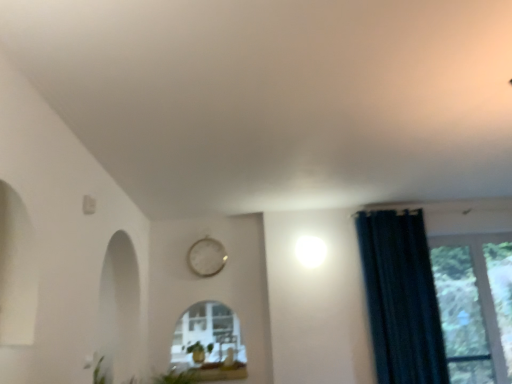
Question: Should I look upward or downward to see dark blue fabric curtain at right?

Choices:
 (A) up
 (B) down

Answer: (B)

Question: Does white glossy window sill at lower center have a greater width compared to dark blue fabric curtain at right?

Choices:
 (A) no
 (B) yes

Answer: (B)

Question: Is dark blue fabric curtain at right at the back of white glossy window sill at lower center?

Choices:
 (A) yes
 (B) no

Answer: (B)

Question: Is white glossy window sill at lower center taller than dark blue fabric curtain at right?

Choices:
 (A) no
 (B) yes

Answer: (A)

Question: Is white glossy window sill at lower center further to camera compared to dark blue fabric curtain at right?

Choices:
 (A) yes
 (B) no

Answer: (A)

Question: From the image's perspective, is white glossy window sill at lower center located beneath dark blue fabric curtain at right?

Choices:
 (A) no
 (B) yes

Answer: (B)

Question: Considering the relative sizes of white glossy window sill at lower center and dark blue fabric curtain at right in the image provided, is white glossy window sill at lower center bigger than dark blue fabric curtain at right?

Choices:
 (A) yes
 (B) no

Answer: (B)

Question: Considering the relative sizes of white glossy window sill at lower center and transparent glass window at right in the image provided, is white glossy window sill at lower center shorter than transparent glass window at right?

Choices:
 (A) no
 (B) yes

Answer: (B)

Question: From a real-world perspective, is white glossy window sill at lower center located beneath transparent glass window at right?

Choices:
 (A) yes
 (B) no

Answer: (A)

Question: Is white glossy window sill at lower center not near transparent glass window at right?

Choices:
 (A) no
 (B) yes

Answer: (B)

Question: From a real-world perspective, is white glossy window sill at lower center located higher than transparent glass window at right?

Choices:
 (A) yes
 (B) no

Answer: (B)

Question: Is white glossy window sill at lower center further to the viewer compared to transparent glass window at right?

Choices:
 (A) yes
 (B) no

Answer: (B)

Question: From the image's perspective, is white glossy window sill at lower center on top of transparent glass window at right?

Choices:
 (A) yes
 (B) no

Answer: (B)

Question: Is transparent glass window at right touching white metallic clock at upper center?

Choices:
 (A) yes
 (B) no

Answer: (B)